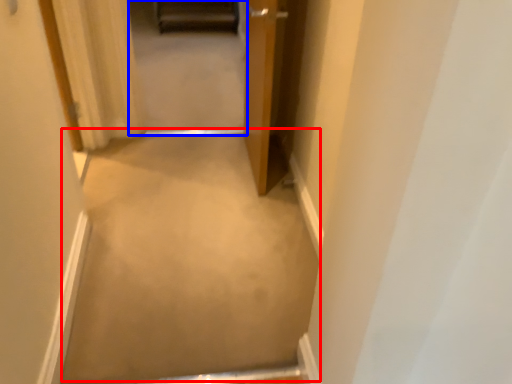
Question: Among these objects, which one is nearest to the camera, plain (highlighted by a red box) or passage (highlighted by a blue box)?

Choices:
 (A) plain
 (B) passage

Answer: (A)